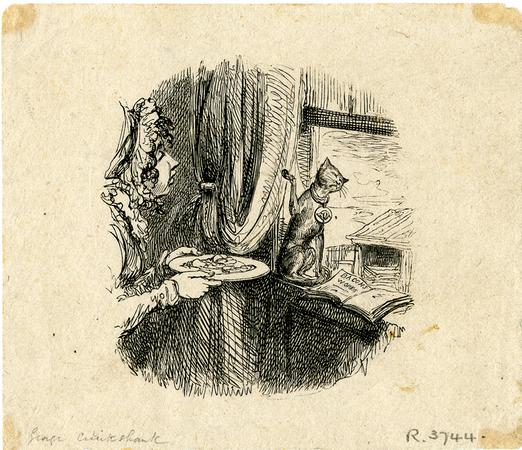
At what (x,y) coordinates should I click in order to perform the action: click on plate. Please return your answer as a coordinate pair (x, y). Looking at the image, I should click on click(x=251, y=280).